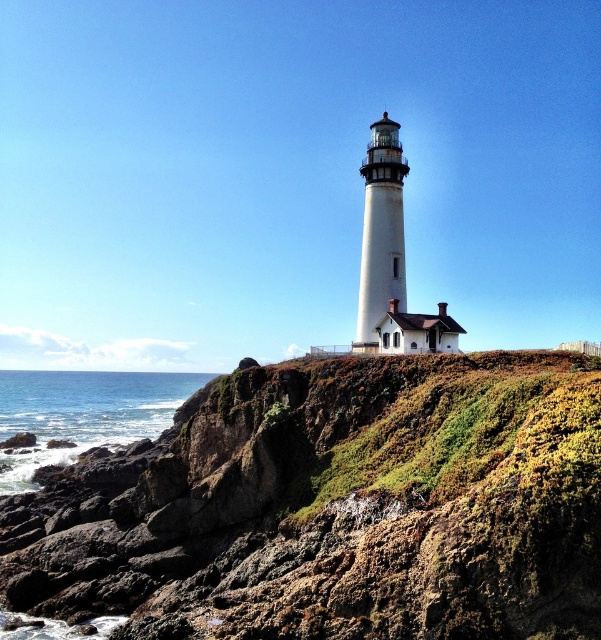
Does point (435, 474) come farther from viewer compared to point (76, 420)?

No, (435, 474) is in front of (76, 420).

Does green mossy rock at center have a greater height compared to blue water at lower left?

Yes, green mossy rock at center is taller than blue water at lower left.

Does point (558, 602) come behind point (91, 413)?

No, it is in front of (91, 413).

Image resolution: width=601 pixels, height=640 pixels. Find the location of `green mossy rock at center`. green mossy rock at center is located at coordinates (334, 506).